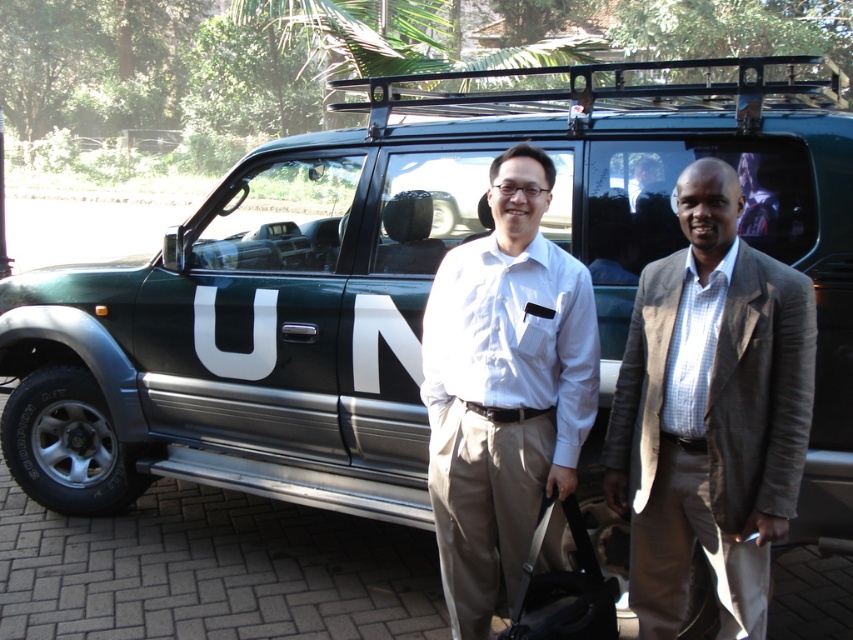
What does the point at coordinates (503, 387) indicate in the image?

The point at coordinates (503, 387) marks the green matte UN vehicle at center.

You are a delivery person who needs to load a black leather suitcase at center into the trunk of a green matte un vehicle at center. Based on their sizes, do you think the suitcase will fit inside the trunk without any adjustments?

The green matte un vehicle at center might be wider than black leather suitcase at center, so there is a possibility that the black leather suitcase at center can fit inside the trunk. However, since the exact dimensions are not provided, it is recommended to check the trunk size before loading.